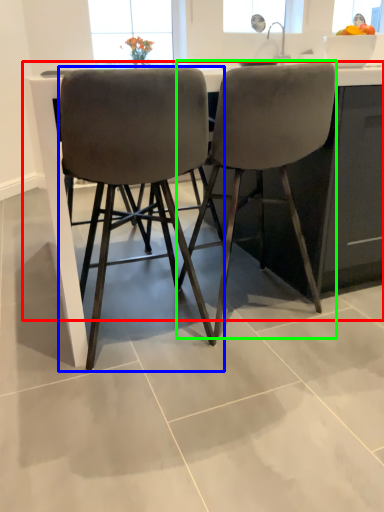
Question: Estimate the real-world distances between objects in this image. Which object is closer to counter (highlighted by a red box), chair (highlighted by a blue box) or chair (highlighted by a green box)?

Choices:
 (A) chair
 (B) chair

Answer: (A)